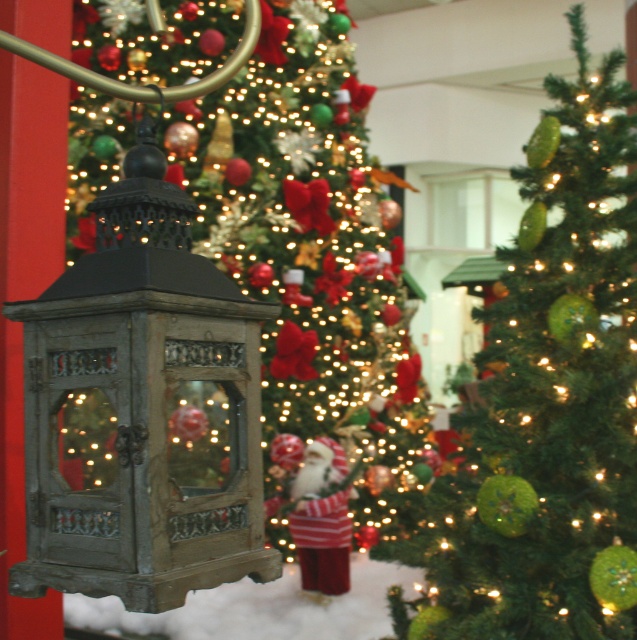
You are a decorator who wants to place a new decoration in the scene. The decoration is 20 cm wide. You have two options to place it either on the green textured christmas tree at center or among the green textured ornaments at center. Which location can accommodate the decoration without overcrowding?

The green textured christmas tree at center has a larger width than the green textured ornaments at center, so placing the 20 cm wide decoration on the green textured christmas tree at center would provide more space and prevent overcrowding.

You are standing at the entrance of the mall and want to take a photo of the green textured christmas tree at center. Where should you stand to ensure the tree is in the center of your camera frame?

The green textured christmas tree at center is located at point 0.364 on the x axis and 0.484 on the y axis, so you should position yourself directly in front of that coordinate to center it in your camera frame.

Looking at this image, you are standing in front of the green textured christmas tree at center and want to reach the green textured ornaments at center. Which direction should you move to get closer to the ornaments?

The green textured ornaments at center are behind the green textured christmas tree at center, so you should move forward to get closer to them.